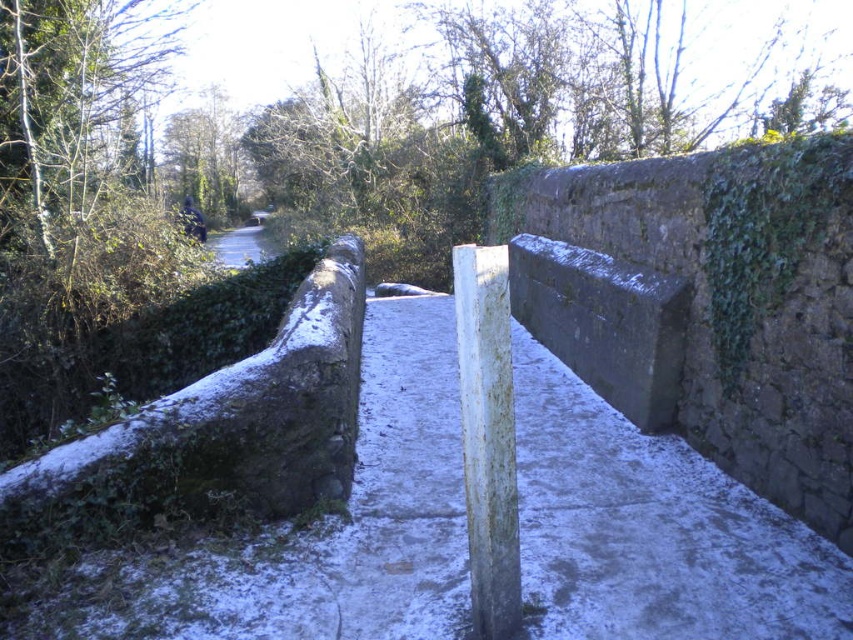
Question: Is gray stone barrier at center further to the viewer compared to white weathered wood post at center?

Choices:
 (A) yes
 (B) no

Answer: (A)

Question: Which of the following is the closest to the observer?

Choices:
 (A) gray stone barrier at center
 (B) white weathered wood post at center

Answer: (B)

Question: Which of the following is the closest to the observer?

Choices:
 (A) gray stone barrier at center
 (B) white weathered wood post at center

Answer: (B)

Question: Among these points, which one is nearest to the camera?

Choices:
 (A) (479, 550)
 (B) (614, 324)

Answer: (A)

Question: Can you confirm if gray stone barrier at center is wider than white weathered wood post at center?

Choices:
 (A) no
 (B) yes

Answer: (B)

Question: Is gray stone barrier at center below white weathered wood post at center?

Choices:
 (A) yes
 (B) no

Answer: (B)